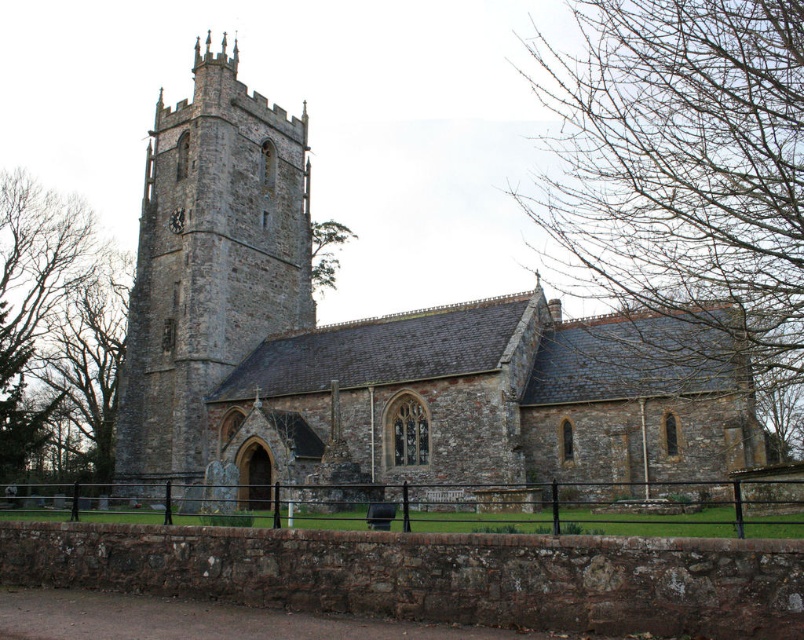
Can you confirm if stone church at center is positioned above bare branches at upper right?

Actually, stone church at center is below bare branches at upper right.

Who is shorter, stone church at center or bare branches at upper right?

stone church at center

Locate an element on the screen. stone church at center is located at coordinates (374, 348).

You are a GUI agent. You are given a task and a screenshot of the screen. Output one action in this format:
    pyautogui.click(x=<x>, y=<y>)
    Task: Click on the stone church at center
    The height and width of the screenshot is (640, 804).
    Given the screenshot: What is the action you would take?
    pyautogui.click(x=374, y=348)

Can you confirm if bare branches at upper right is bigger than brown leafless tree at left?

Indeed, bare branches at upper right has a larger size compared to brown leafless tree at left.

Measure the distance between bare branches at upper right and brown leafless tree at left.

bare branches at upper right is 70.63 meters away from brown leafless tree at left.

Between point (573, 182) and point (13, 316), which one is positioned in front?

Positioned in front is point (573, 182).

The height and width of the screenshot is (640, 804). Find the location of `bare branches at upper right`. bare branches at upper right is located at coordinates (687, 177).

Is stone tower at center-left thinner than brown leafless tree at left?

Yes, stone tower at center-left is thinner than brown leafless tree at left.

Which is more to the left, stone tower at center-left or brown leafless tree at left?

brown leafless tree at left

Who is more distant from viewer, (222,74) or (59,401)?

Point (59,401)

At what (x,y) coordinates should I click in order to perform the action: click on stone tower at center-left. Please return your answer as a coordinate pair (x, y). This screenshot has width=804, height=640. Looking at the image, I should click on (208, 262).